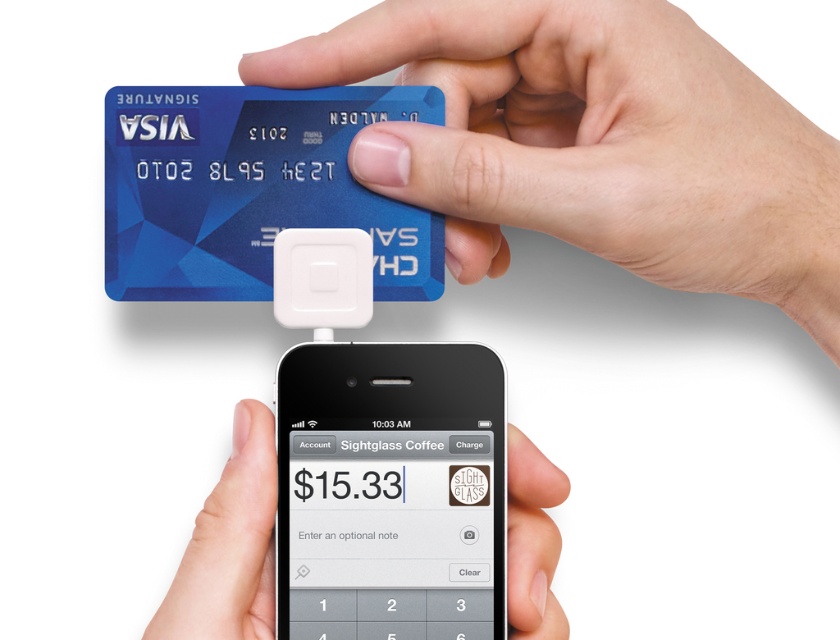
Question: Is blue plastic card at upper center to the right of white matte phone at lower center from the viewer's perspective?

Choices:
 (A) no
 (B) yes

Answer: (A)

Question: Observing the image, what is the correct spatial positioning of black plastic phone at center in reference to blue plastic card at upper center?

Choices:
 (A) below
 (B) above

Answer: (A)

Question: Which of the following is the farthest from the observer?

Choices:
 (A) black plastic phone at center
 (B) white matte phone at lower center
 (C) blue plastic card at upper center

Answer: (C)

Question: Which of the following is the farthest from the observer?

Choices:
 (A) white matte phone at lower center
 (B) blue plastic card at upper center
 (C) black plastic phone at center
 (D) blue plastic credit card at upper center

Answer: (B)

Question: Which point appears farthest from the camera in this image?

Choices:
 (A) pyautogui.click(x=324, y=116)
 (B) pyautogui.click(x=334, y=454)
 (C) pyautogui.click(x=516, y=509)

Answer: (A)

Question: Can you confirm if blue plastic credit card at upper center is bigger than black plastic phone at center?

Choices:
 (A) no
 (B) yes

Answer: (B)